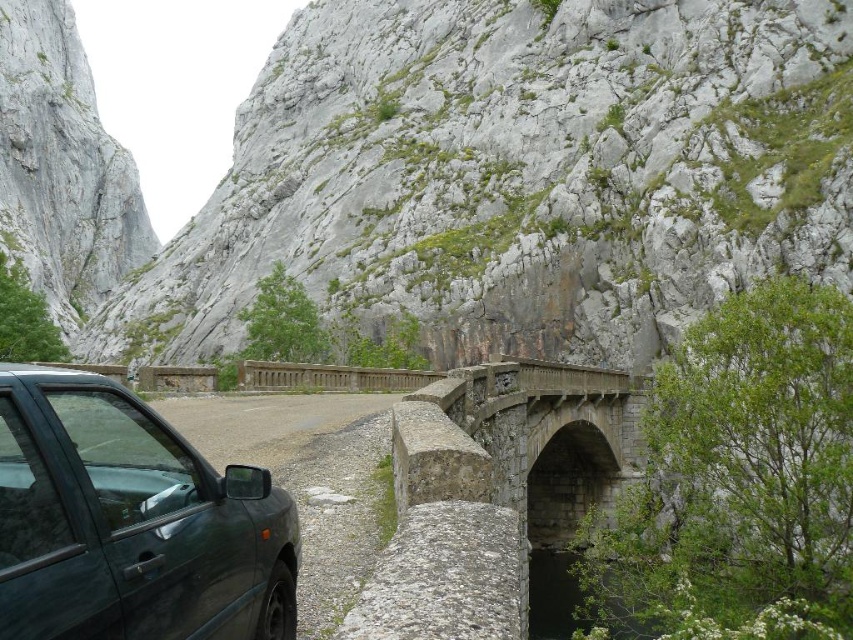
Question: Among these points, which one is farthest from the camera?

Choices:
 (A) (434, 440)
 (B) (245, 396)

Answer: (B)

Question: Is stone arch bridge at center bigger than green matte car at lower left?

Choices:
 (A) yes
 (B) no

Answer: (A)

Question: Can you confirm if gray rock wall at upper center is positioned below green matte car at lower left?

Choices:
 (A) yes
 (B) no

Answer: (B)

Question: Which of the following is the farthest from the observer?

Choices:
 (A) dark green matte car at lower left
 (B) green matte car at lower left
 (C) stone arch bridge at center
 (D) gray rock wall at upper center

Answer: (D)

Question: Which object is positioned farthest from the gray rock wall at upper left?

Choices:
 (A) green matte car at lower left
 (B) stone arch bridge at center

Answer: (B)

Question: Is gray rock wall at upper center thinner than green matte car at lower left?

Choices:
 (A) yes
 (B) no

Answer: (B)